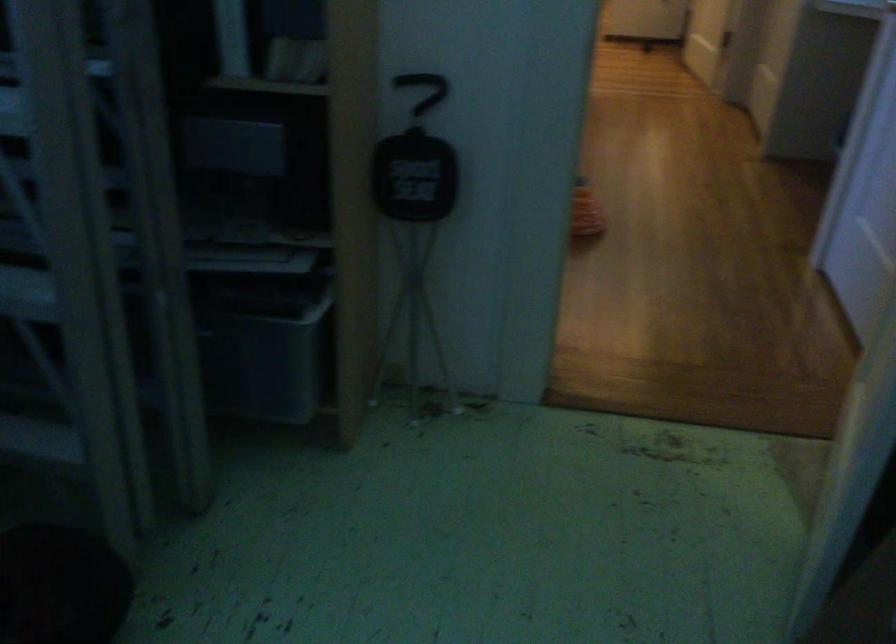
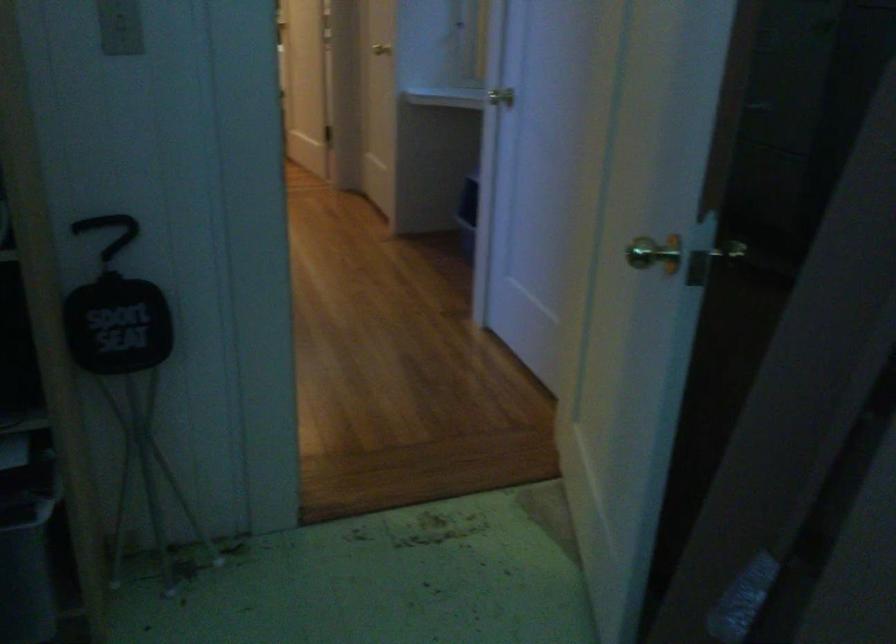
Where in the second image is the point corresponding to pixel 420 89 from the first image?

(108, 232)